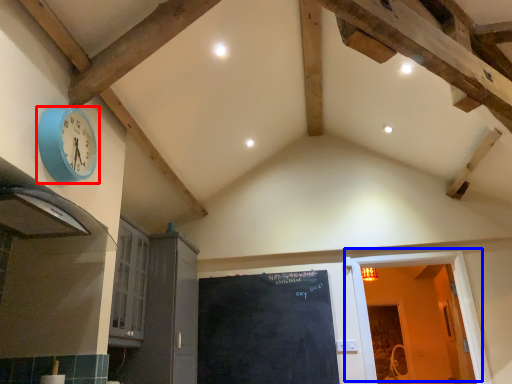
Question: Among these objects, which one is nearest to the camera, wall clock (highlighted by a red box) or door (highlighted by a blue box)?

Choices:
 (A) wall clock
 (B) door

Answer: (A)